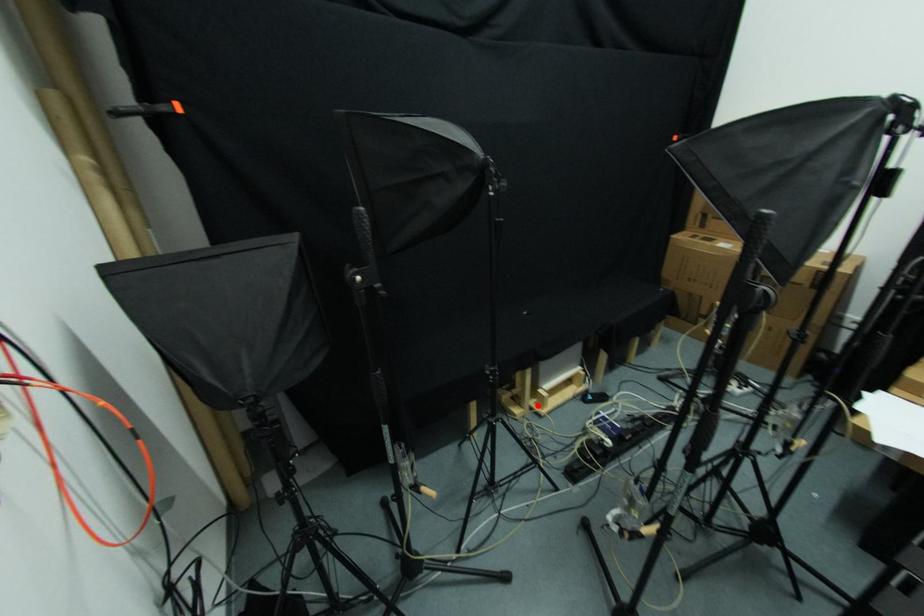
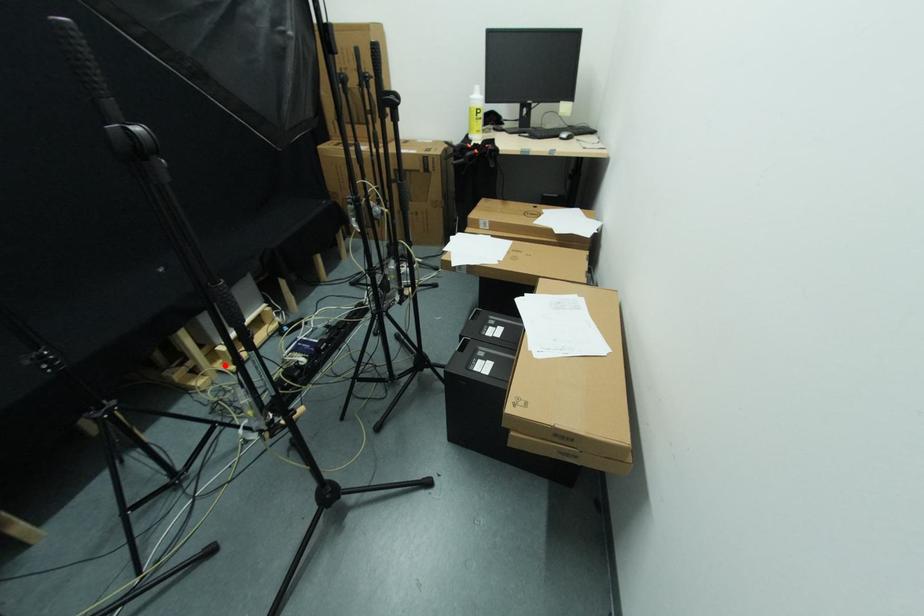
I am providing you with two images of the same scene from different viewpoints. A red point is marked on the first image and another point is marked on the second image. Are the points marked in image1 and image2 representing the same 3D position?

Yes